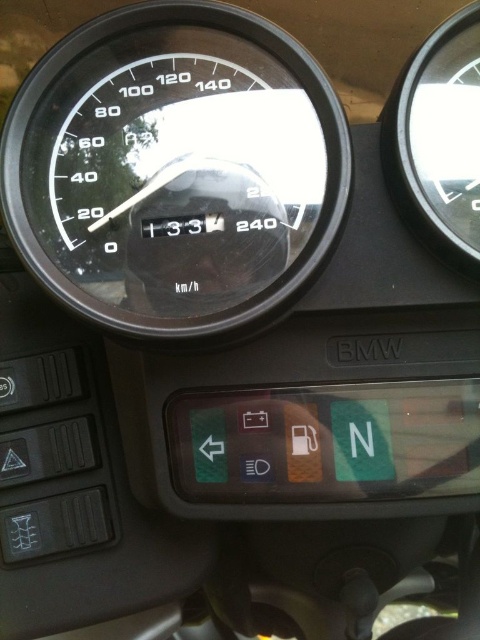
You are a motorcycle enthusiast checking the dashboard of a BMW motorcycle. You notice two speedometers. The first is the black glass speedometer at center, and the second is the transparent glass speedometer at upper right. Which one do you think is bigger in size?

The black glass speedometer at center has a larger size compared to the transparent glass speedometer at upper right, so the black glass speedometer at center is bigger in size.

You are a photographer who wants to capture a detailed closeup of the black glass speedometer at center. The camera you are using has a minimum focusing distance of 30 inches. Can you take the photo without moving the camera closer?

The black glass speedometer at center is 30.64 inches from the camera. Since the minimum focusing distance is 30 inches, the camera can focus on the black glass speedometer at center as it is within the required distance.

You are a rider checking your motorcycle dashboard. You see the point at coordinates (169, 168). What object is located at that point?

The black glass speedometer at center is located at point (169, 168).